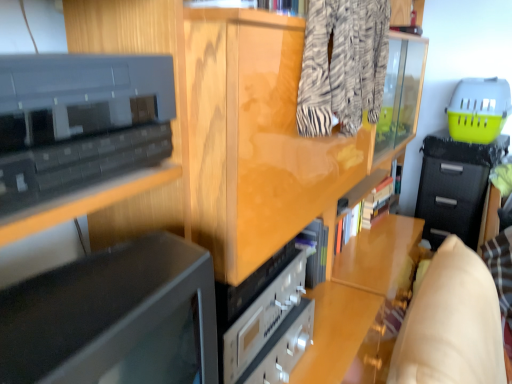
Locate an element on the screen. zebra-patterned fabric at upper center is located at coordinates (343, 65).

Can you confirm if black fabric drawer at right is positioned to the right of black glossy cabinet at upper left?

Yes, black fabric drawer at right is to the right of black glossy cabinet at upper left.

What are the coordinates of `cabinetry that appears above the black fabric drawer at right (from the image's perspective)` in the screenshot? It's located at (79, 121).

Is black fabric drawer at right smaller than black glossy cabinet at upper left?

No, black fabric drawer at right is not smaller than black glossy cabinet at upper left.

From the picture: From a real-world perspective, is black fabric drawer at right located beneath zebra-patterned fabric at upper center?

Yes, from a real-world perspective, black fabric drawer at right is beneath zebra-patterned fabric at upper center.

Locate an element on the screen. clothing above the black fabric drawer at right (from a real-world perspective) is located at coordinates [343, 65].

From the image's perspective, does black fabric drawer at right appear higher than zebra-patterned fabric at upper center?

Actually, black fabric drawer at right appears below zebra-patterned fabric at upper center in the image.

Is black fabric drawer at right at the left side of zebra-patterned fabric at upper center?

No.

This screenshot has width=512, height=384. Identify the location of cabinetry lying on the left of zebra-patterned fabric at upper center. (79, 121).

Is black glossy cabinet at upper left not inside zebra-patterned fabric at upper center?

Yes, black glossy cabinet at upper left is not within zebra-patterned fabric at upper center.

Is black glossy cabinet at upper left closer to camera compared to black fabric drawer at right?

Yes, black glossy cabinet at upper left is closer to the camera.

Is black glossy cabinet at upper left taller than black fabric drawer at right?

No, black glossy cabinet at upper left is not taller than black fabric drawer at right.

Looking at this image, from the image's perspective, is black glossy cabinet at upper left above black fabric drawer at right?

Yes.

Is black fabric drawer at right at the back of black glossy cabinet at upper left?

No, black glossy cabinet at upper left's orientation is not away from black fabric drawer at right.

Which object is thinner, zebra-patterned fabric at upper center or black fabric drawer at right?

Thinner between the two is zebra-patterned fabric at upper center.

Is zebra-patterned fabric at upper center situated inside black fabric drawer at right or outside?

zebra-patterned fabric at upper center exists outside the volume of black fabric drawer at right.

From the image's perspective, is zebra-patterned fabric at upper center above black fabric drawer at right?

Yes, from the image's perspective, zebra-patterned fabric at upper center is over black fabric drawer at right.

Is zebra-patterned fabric at upper center looking in the opposite direction of black fabric drawer at right?

zebra-patterned fabric at upper center does not have its back to black fabric drawer at right.

Which is closer, [358,112] or [42,89]?

Positioned in front is point [42,89].

From the picture: Which of these two, zebra-patterned fabric at upper center or black glossy cabinet at upper left, is smaller?

black glossy cabinet at upper left is smaller.

Is zebra-patterned fabric at upper center closer to camera compared to black glossy cabinet at upper left?

No, the depth of zebra-patterned fabric at upper center is greater than that of black glossy cabinet at upper left.

Is zebra-patterned fabric at upper center facing towards black glossy cabinet at upper left?

No, zebra-patterned fabric at upper center is not aimed at black glossy cabinet at upper left.

The height and width of the screenshot is (384, 512). In order to click on drawer lying on the right of black glossy cabinet at upper left in this screenshot , I will do `click(451, 200)`.

The image size is (512, 384). In order to click on drawer below the zebra-patterned fabric at upper center (from the image's perspective) in this screenshot , I will do `click(451, 200)`.

In the scene shown: Looking at the image, which one is located closer to black fabric drawer at right, black glossy cabinet at upper left or zebra-patterned fabric at upper center?

zebra-patterned fabric at upper center.

From the image, which object appears to be nearer to zebra-patterned fabric at upper center, black glossy cabinet at upper left or black fabric drawer at right?

black glossy cabinet at upper left is positioned closer to the anchor zebra-patterned fabric at upper center.

Looking at the image, which one is located further to black fabric drawer at right, zebra-patterned fabric at upper center or black glossy cabinet at upper left?

black glossy cabinet at upper left is further to black fabric drawer at right.

Based on their spatial positions, is black fabric drawer at right or black glossy cabinet at upper left further from zebra-patterned fabric at upper center?

black fabric drawer at right is further to zebra-patterned fabric at upper center.

Which object lies further to the anchor point black glossy cabinet at upper left, black fabric drawer at right or zebra-patterned fabric at upper center?

The object further to black glossy cabinet at upper left is black fabric drawer at right.

From the image, which object appears to be farther from black glossy cabinet at upper left, zebra-patterned fabric at upper center or black fabric drawer at right?

black fabric drawer at right is positioned further to the anchor black glossy cabinet at upper left.

You are a GUI agent. You are given a task and a screenshot of the screen. Output one action in this format:
    pyautogui.click(x=<x>, y=<y>)
    Task: Click on the clothing between black glossy cabinet at upper left and black fabric drawer at right along the z-axis
    The width and height of the screenshot is (512, 384).
    Given the screenshot: What is the action you would take?
    pyautogui.click(x=343, y=65)